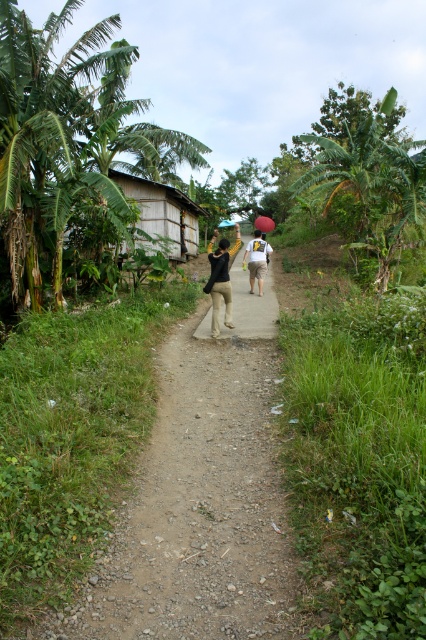
You are standing at the wooden structure on the left side of the path and want to take a photo of the two people walking away. Which point, point (198, 426) or point (140, 225), should you focus on to capture the person closer to you?

You should focus on point (198, 426) because it is closer to the camera than point (140, 225), meaning the person at that point will appear larger and more prominent in the photo.

You are standing at the point labeled as point (201, 497) in the image. Looking around, you see the dirt path at center and the small wooden structure on the left side of the path. Which direction should you walk to reach the small wooden structure?

Since point (201, 497) corresponds to the dirt path at center, you should walk towards the left side of the path to reach the small wooden structure on the left side of the path.